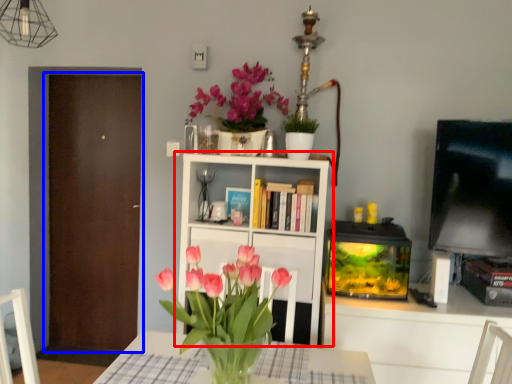
Question: Which object appears closest to the camera in this image, bookcase (highlighted by a red box) or door (highlighted by a blue box)?

Choices:
 (A) bookcase
 (B) door

Answer: (A)